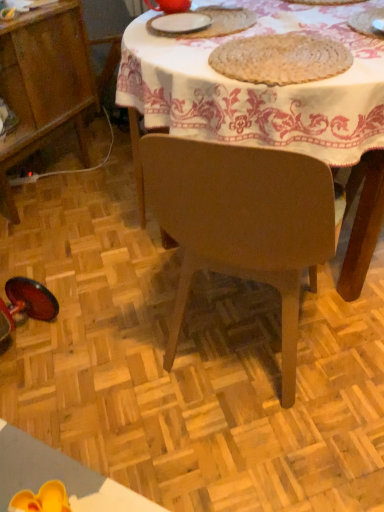
Where is `unoccupied region to the right of matte red teapot at upper center, the 3th tableware in the right-to-left sequence`? Image resolution: width=384 pixels, height=512 pixels. unoccupied region to the right of matte red teapot at upper center, the 3th tableware in the right-to-left sequence is located at coordinates (228, 12).